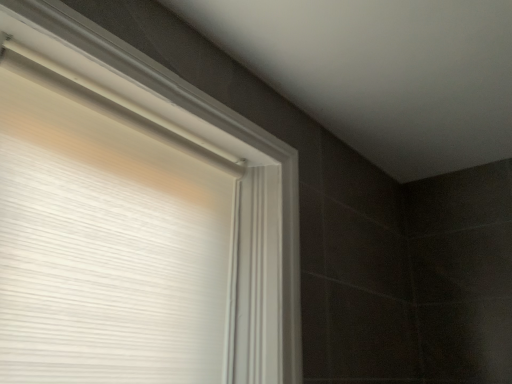
The image size is (512, 384). What are the coordinates of `white matte window frame at upper left` in the screenshot? It's located at (203, 119).

From the picture: What is the approximate width of white matte window frame at upper left?

10.26 inches.

In order to face white matte window frame at upper left, should I rotate leftwards or rightwards?

You should look left and rotate roughly 13.644 degrees.

Describe the element at coordinates (203, 119) in the screenshot. The height and width of the screenshot is (384, 512). I see `white matte window frame at upper left` at that location.

Find the location of a particular element. white matte window frame at upper left is located at coordinates 203,119.